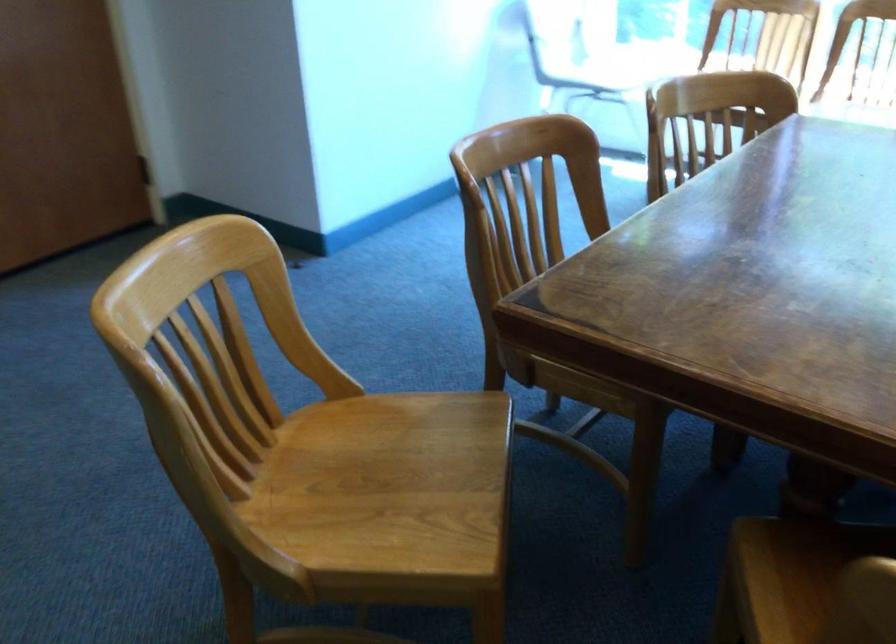
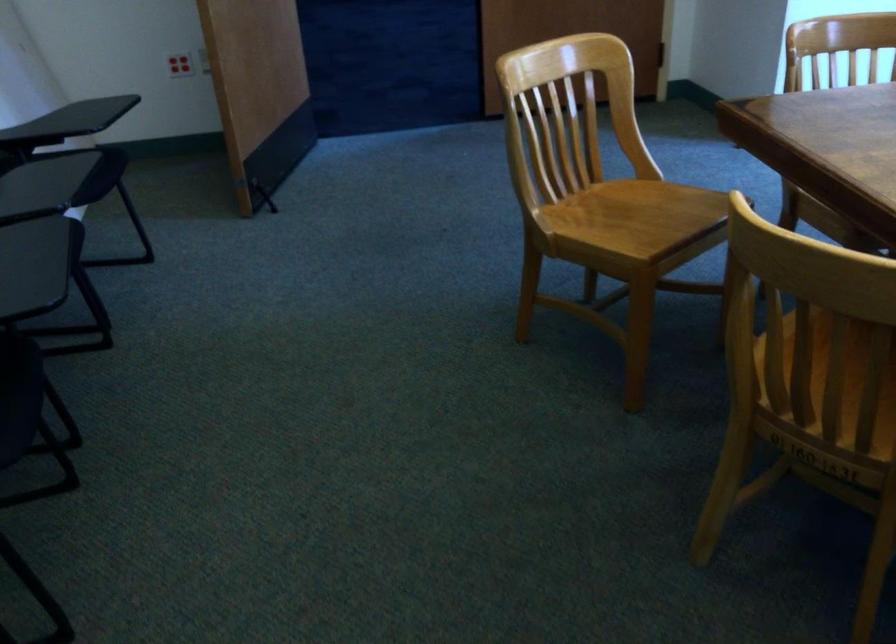
The point at (399, 474) is marked in the first image. Where is the corresponding point in the second image?

(640, 216)